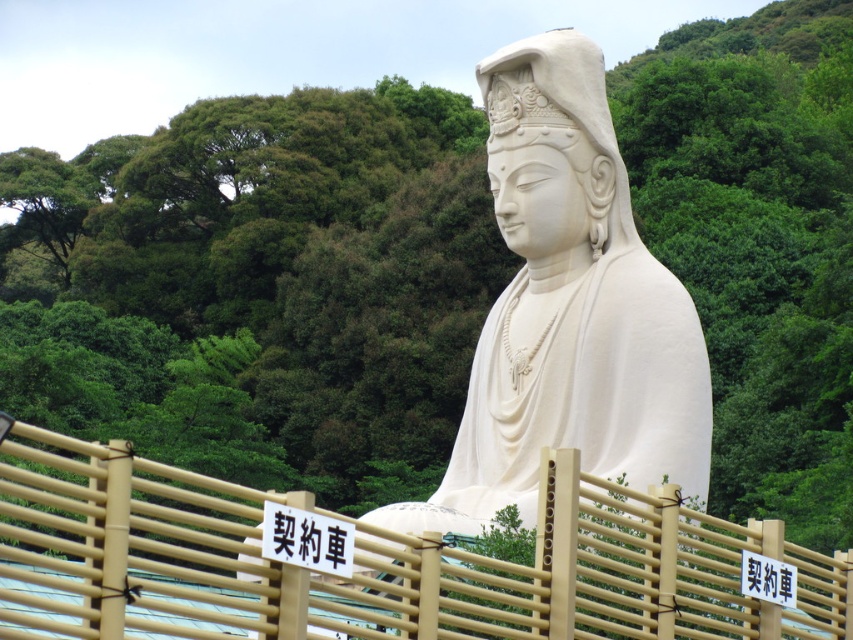
You are a tourist visiting the statue and want to read the black paper sign at center. However, you notice the bamboo fence at center is blocking your view. Can you still read the sign without moving closer?

The bamboo fence at center is larger in size than black paper sign at center, so it is blocking the view of the sign. You will need to move closer to read the black paper sign at center.

You are a visitor at the statue and want to take a photo of the white marble statue at center without the bamboo fence at center appearing in the frame. Which direction should you move to achieve this?

Move to the right side of the white marble statue at center so that the bamboo fence at center is no longer in the frame.